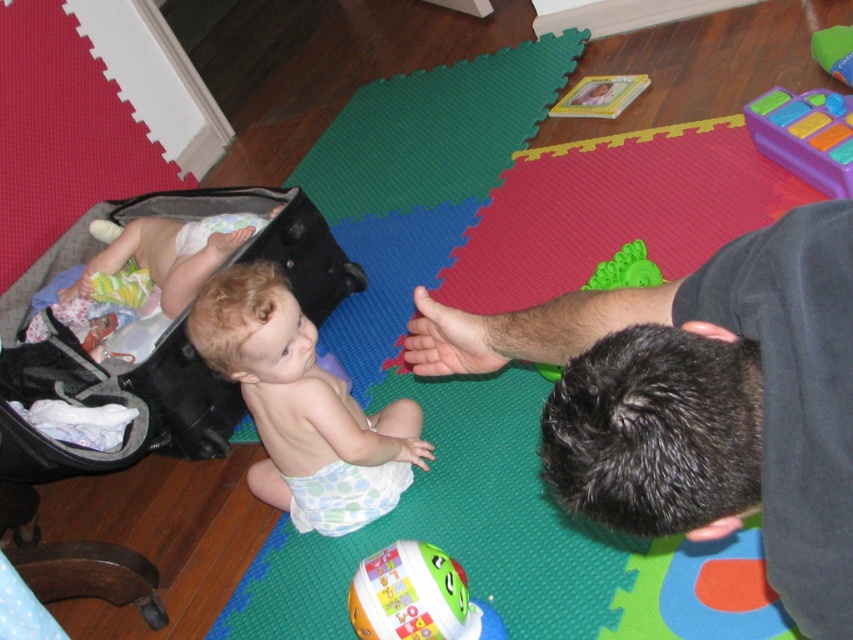
You are a parent trying to retrieve the white plastic toy at lower center from the play mat. There is a black fabric baby carriage at left in the way. Can you easily reach the toy without moving the carriage?

The black fabric baby carriage at left is further to the viewer than the white plastic toy at lower center, meaning the carriage is closer to you. Since the carriage is blocking your direct path, you would need to move it to access the toy easily.

From the picture: What object is located at the coordinates point (158, 342) in the image?

The point (158, 342) indicates the location of the black fabric baby carriage at left.

You are a parent trying to place the white plastic toy at lower center into the black fabric baby carriage at left. Based on their sizes, will the toy fit inside the carriage?

The black fabric baby carriage at left might be wider than white plastic toy at lower center, so there is a possibility that the toy will fit inside the carriage.